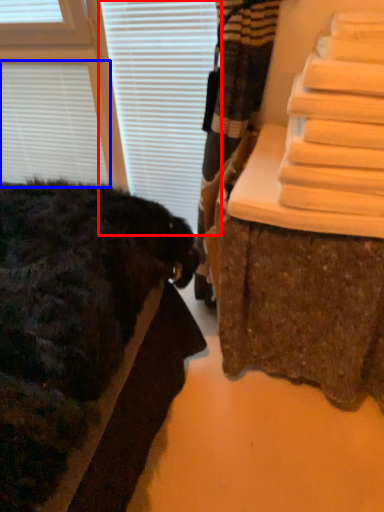
Question: Which of the following is the closest to the observer, blind (highlighted by a red box) or blind (highlighted by a blue box)?

Choices:
 (A) blind
 (B) blind

Answer: (A)